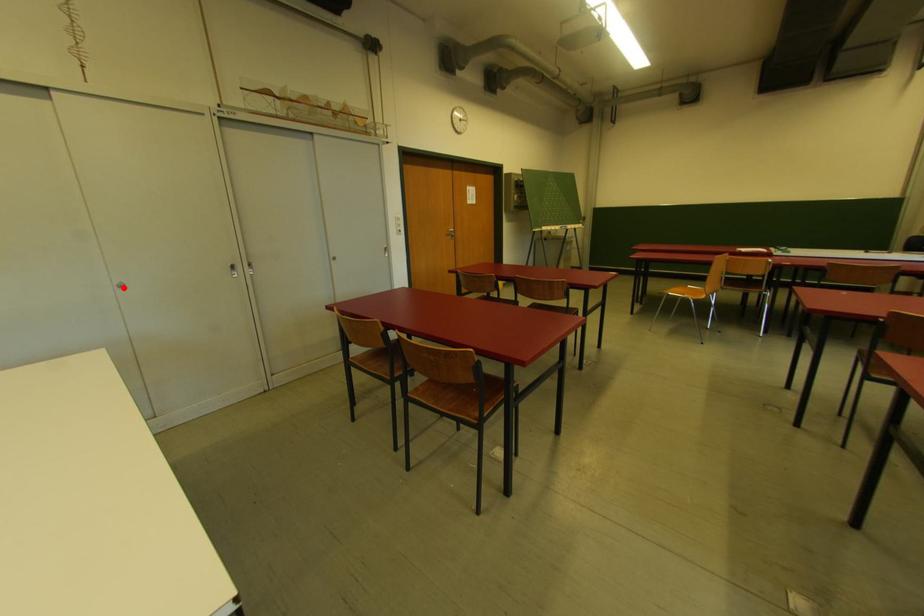
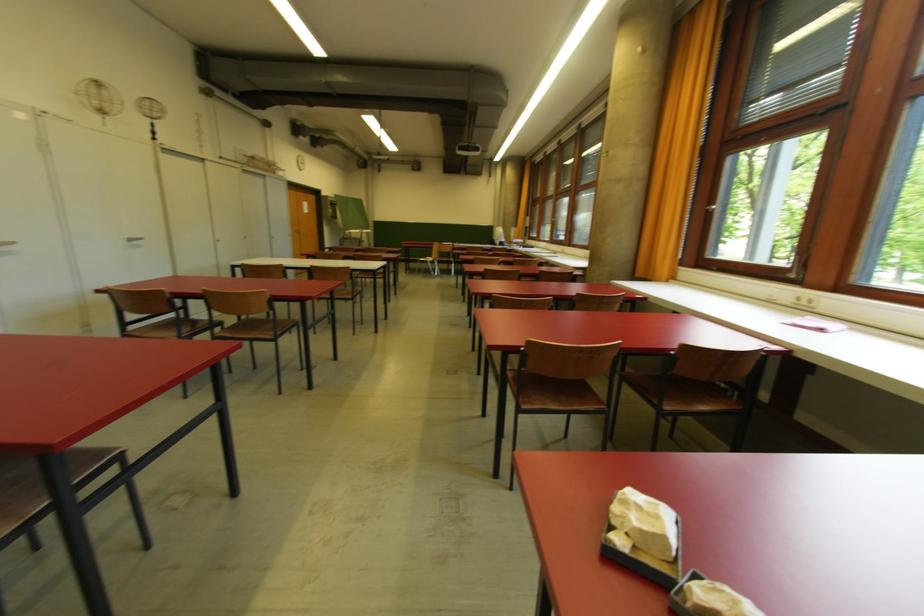
Find the pixel in the second image that matches the highlighted location in the first image.

(221, 243)